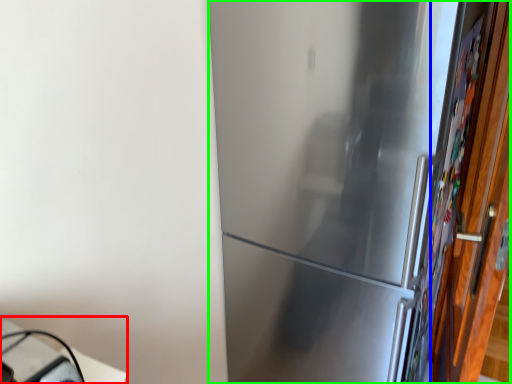
Question: Based on their relative distances, which object is farther from table (highlighted by a red box)? Choose from door (highlighted by a blue box) and refrigerator (highlighted by a green box).

Choices:
 (A) door
 (B) refrigerator

Answer: (A)